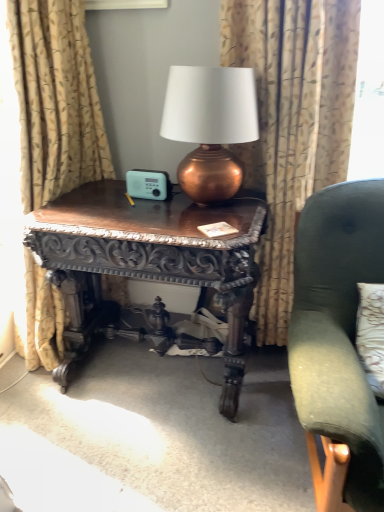
In order to click on free spot in front of copper metallic lamp at center in this screenshot , I will do `click(189, 226)`.